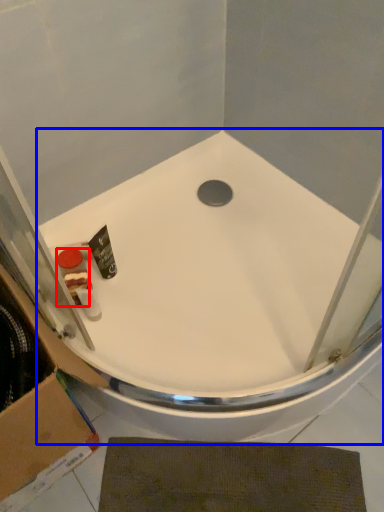
Question: Which object is closer to the camera taking this photo, toiletry (highlighted by a red box) or bathtub (highlighted by a blue box)?

Choices:
 (A) toiletry
 (B) bathtub

Answer: (B)